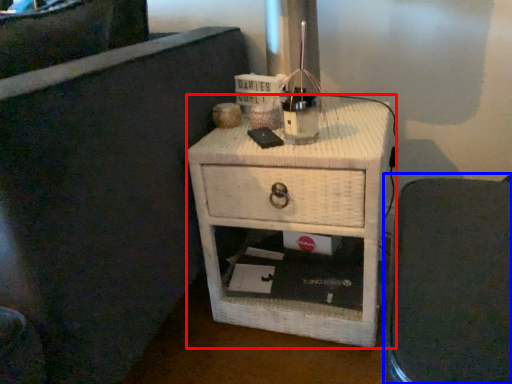
Question: Which of the following is the farthest to the observer, nightstand (highlighted by a red box) or furniture (highlighted by a blue box)?

Choices:
 (A) nightstand
 (B) furniture

Answer: (A)